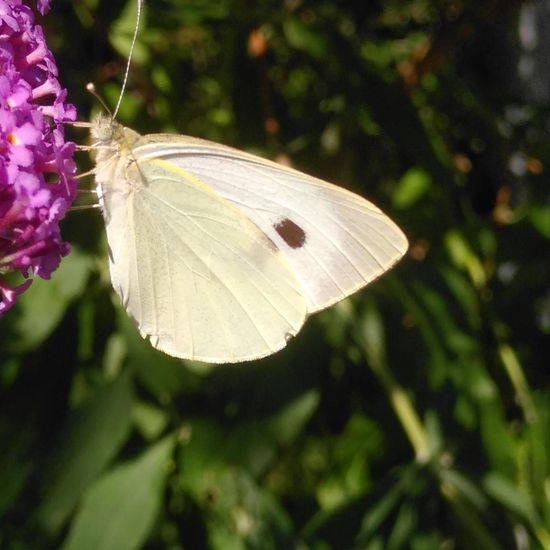
This screenshot has height=550, width=550. I want to click on flower on the top left corner, so click(x=14, y=14).